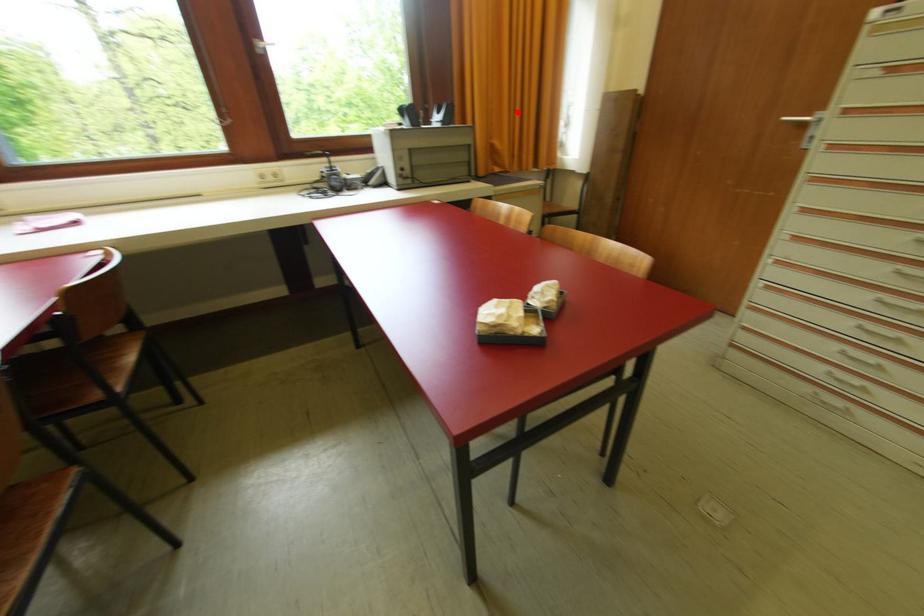
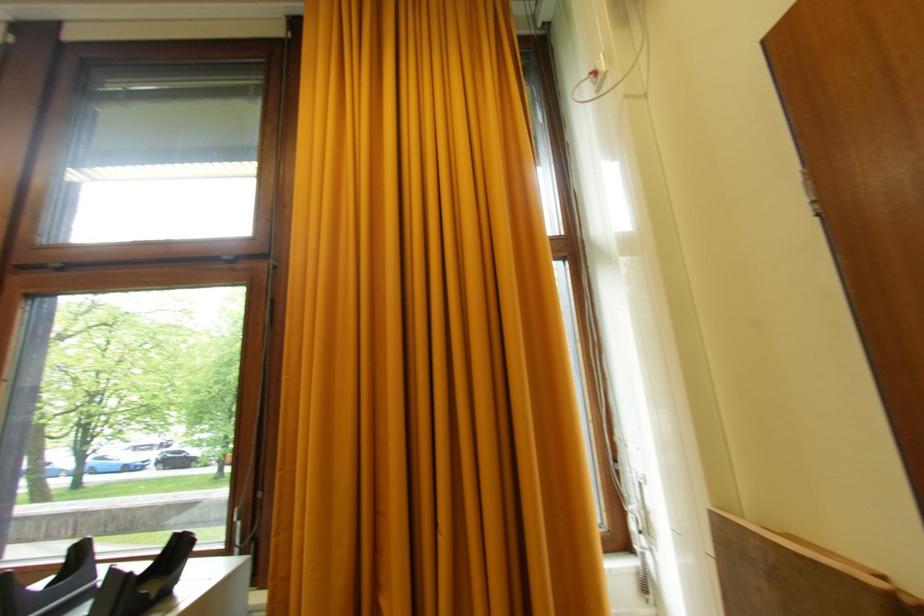
Question: I am providing you with two images of the same scene from different viewpoints. Given a red point in image1, look at the same physical point in image2. Is it:

Choices:
 (A) Closer to the viewpoint
 (B) Farther from the viewpoint

Answer: (B)